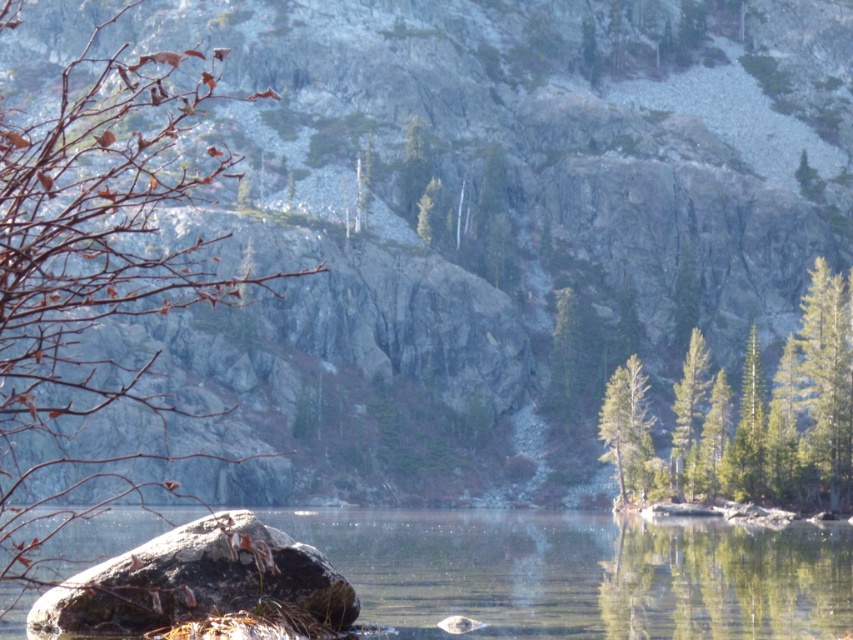
Can you confirm if green textured pine tree at center-right is thinner than green textured tree at center?

In fact, green textured pine tree at center-right might be wider than green textured tree at center.

Does green textured pine tree at center-right lie in front of green textured tree at center?

That is True.

Is point (755, 332) closer to viewer compared to point (683, 385)?

Yes.

This screenshot has width=853, height=640. I want to click on green textured pine tree at center-right, so click(x=747, y=429).

The height and width of the screenshot is (640, 853). What do you see at coordinates (582, 573) in the screenshot? I see `smooth rock at lower left` at bounding box center [582, 573].

Locate an element on the screen. smooth rock at lower left is located at coordinates pyautogui.click(x=582, y=573).

Find the location of a particular element. smooth rock at lower left is located at coordinates (582, 573).

In the scene shown: Does brown leafy branch at left appear on the left side of green matte tree at right?

Indeed, brown leafy branch at left is positioned on the left side of green matte tree at right.

Who is more forward, (x=128, y=369) or (x=850, y=333)?

Positioned in front is point (x=850, y=333).

Who is more distant from viewer, (97, 186) or (816, 296)?

The point (816, 296) is behind.

Identify the location of brown leafy branch at left. (91, 275).